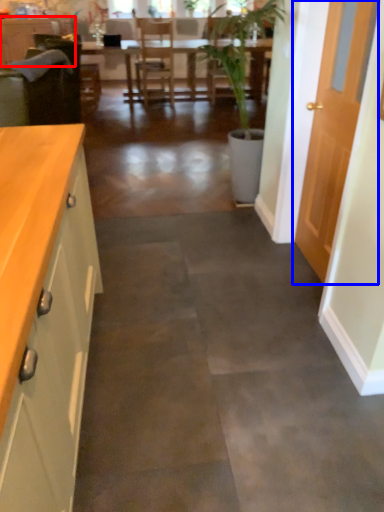
Question: Which object is closer to the camera taking this photo, cabinetry (highlighted by a red box) or door (highlighted by a blue box)?

Choices:
 (A) cabinetry
 (B) door

Answer: (B)